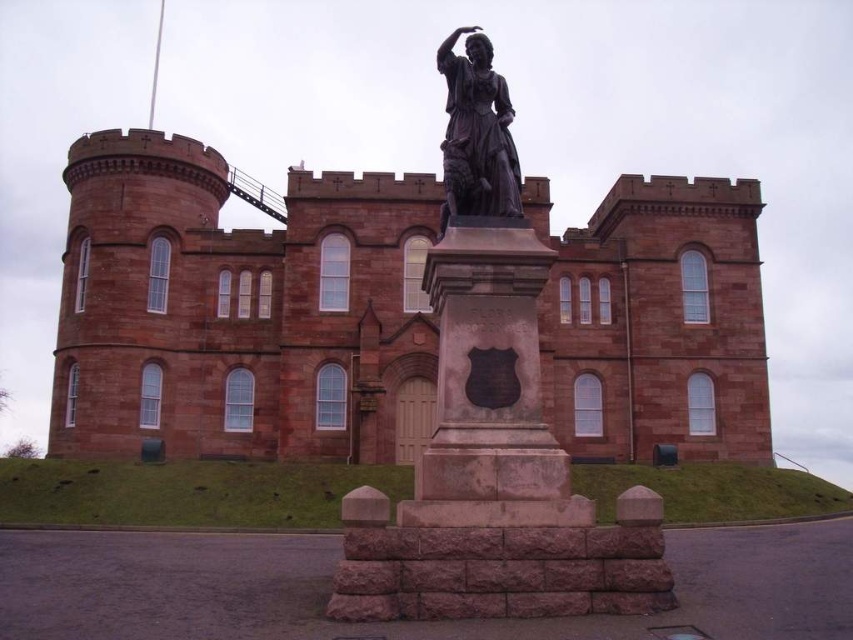
Question: Is red stone castle at center above bronze statue at center?

Choices:
 (A) no
 (B) yes

Answer: (A)

Question: Is the position of red stone castle at center less distant than that of bronze statue at center?

Choices:
 (A) no
 (B) yes

Answer: (A)

Question: Can you confirm if red stone castle at center is wider than bronze statue at center?

Choices:
 (A) no
 (B) yes

Answer: (B)

Question: Which of the following is the farthest from the observer?

Choices:
 (A) bronze statue at center
 (B) red stone castle at center

Answer: (B)

Question: Which point appears farthest from the camera in this image?

Choices:
 (A) (572, 413)
 (B) (492, 51)

Answer: (A)

Question: Among these points, which one is nearest to the camera?

Choices:
 (A) (460, 168)
 (B) (132, 412)

Answer: (A)